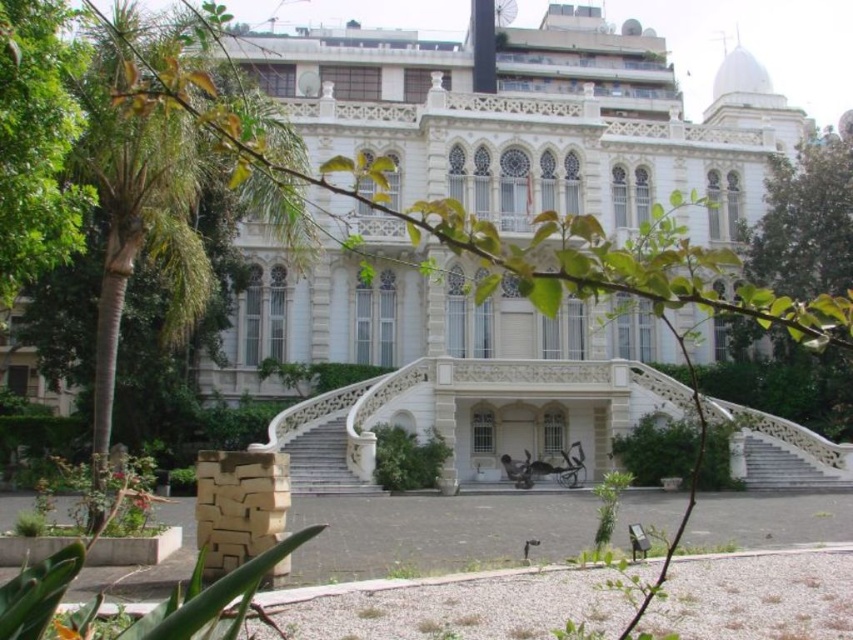
You are standing in front of the grand building and want to take a photo. You notice two points marked on the image. The first point is at coordinate point (27,168) and the second is at point (640,545). Which point is closer to you?

Point (27,168) is closer to the viewer than point (640,545).

You are a visitor standing at the bottom of the staircase leading to the building. You want to find a place to sit and admire the view of the building. Which object, the green leafy tree at left or the wooden park bench at center, would allow you to see the building better?

The wooden park bench at center would allow you to see the building better because the green leafy tree at left is taller than the wooden park bench at center, so sitting at the bench would not block your view by the tree.

In the scene shown: You are standing at the entrance of the grand building and want to sit down to rest. You see the green leafy tree at left and the wooden park bench at center. Which one is closer to you?

The wooden park bench at center is closer to you than the green leafy tree at left because the distance between them is 33.39 meters, so the bench is nearer.